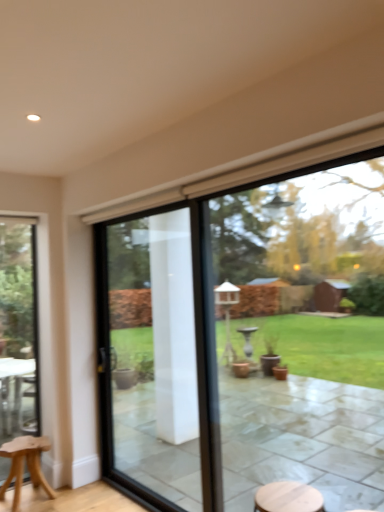
Question: From a real-world perspective, is clear glass door at center located higher than transparent glass window at center, placed as the first window when sorted from front to back?

Choices:
 (A) yes
 (B) no

Answer: (B)

Question: Could transparent glass window at center, the first window when ordered from right to left, be considered to be inside clear glass door at center?

Choices:
 (A) no
 (B) yes

Answer: (A)

Question: Can you see clear glass door at center touching transparent glass window at center, the first window when ordered from right to left?

Choices:
 (A) no
 (B) yes

Answer: (A)

Question: Does clear glass door at center have a smaller size compared to transparent glass window at center, the first window when ordered from right to left?

Choices:
 (A) yes
 (B) no

Answer: (A)

Question: From the image's perspective, does clear glass door at center appear higher than transparent glass window at center, placed as the first window when sorted from front to back?

Choices:
 (A) yes
 (B) no

Answer: (B)

Question: Is transparent glass window at center, placed as the first window when sorted from front to back, at the back of clear glass door at center?

Choices:
 (A) yes
 (B) no

Answer: (B)

Question: From the image's perspective, is clear glass door at left, the 1th window when ordered from left to right, beneath light brown wooden stool at lower left?

Choices:
 (A) yes
 (B) no

Answer: (B)

Question: Is clear glass door at left, acting as the first window starting from the back, behind light brown wooden stool at lower left?

Choices:
 (A) no
 (B) yes

Answer: (B)

Question: Can you confirm if clear glass door at left, acting as the first window starting from the back, is taller than light brown wooden stool at lower left?

Choices:
 (A) no
 (B) yes

Answer: (B)

Question: From the image's perspective, is clear glass door at left, acting as the first window starting from the back, on light brown wooden stool at lower left?

Choices:
 (A) no
 (B) yes

Answer: (B)

Question: Can you confirm if clear glass door at left, the second window when ordered from right to left, is positioned to the left of light brown wooden stool at lower left?

Choices:
 (A) yes
 (B) no

Answer: (A)

Question: Is clear glass door at left, the second window when ordered from right to left, shorter than light brown wooden stool at lower left?

Choices:
 (A) no
 (B) yes

Answer: (A)

Question: From the image's perspective, is light brown wooden stool at lower left located above clear glass door at center?

Choices:
 (A) yes
 (B) no

Answer: (B)